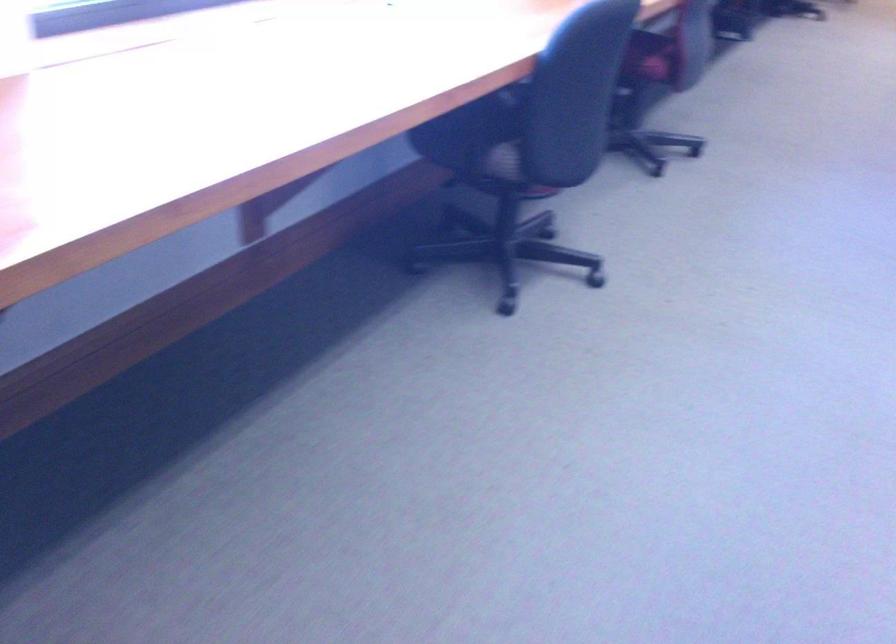
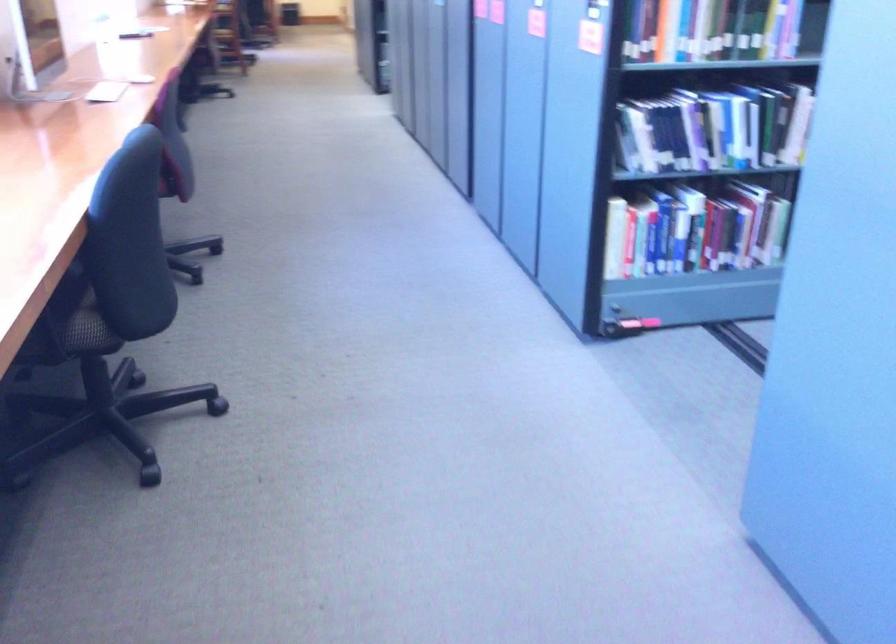
Find the pixel in the second image that matches the point at 490,149 in the first image.

(73, 324)